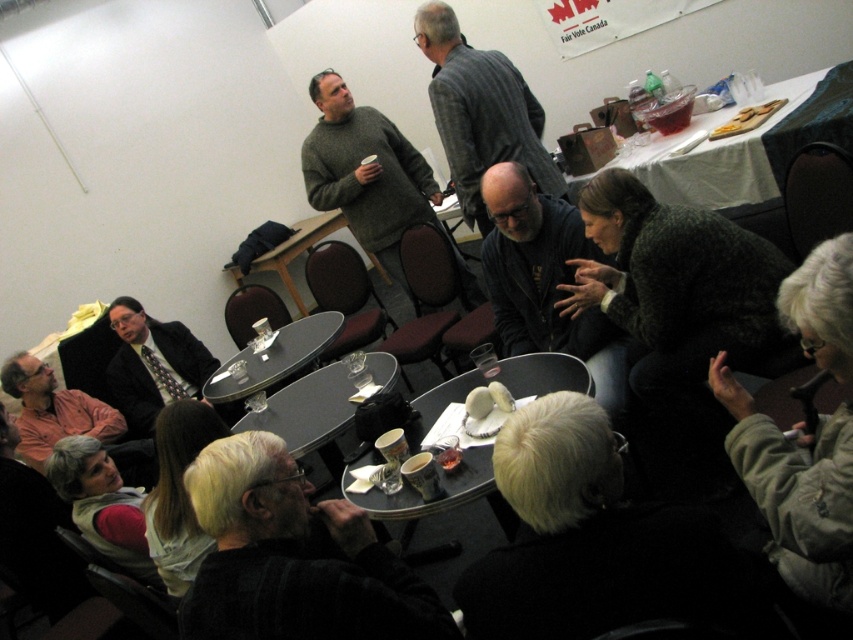
Which of these two, dark gray sweater at center or dark suit at left, stands taller?

dark suit at left

Is point (579, 336) more distant than point (165, 372)?

No, (579, 336) is closer to viewer.

Locate an element on the screen. dark gray sweater at center is located at coordinates (535, 266).

Does gray wool sweater at center appear on the left side of black glossy table at center?

Incorrect, gray wool sweater at center is not on the left side of black glossy table at center.

Who is higher up, gray wool sweater at center or black glossy table at center?

gray wool sweater at center is higher up.

Is point (509, 61) closer to camera compared to point (329, 461)?

No, (509, 61) is further to viewer.

You are a GUI agent. You are given a task and a screenshot of the screen. Output one action in this format:
    pyautogui.click(x=<x>, y=<y>)
    Task: Click on the gray wool sweater at center
    
    Given the screenshot: What is the action you would take?
    pyautogui.click(x=480, y=113)

Looking at this image, can you confirm if dark gray sweater at lower center is taller than black glass table at center?

No, dark gray sweater at lower center is not taller than black glass table at center.

Is dark gray sweater at lower center positioned behind black glass table at center?

No, dark gray sweater at lower center is in front of black glass table at center.

Which is behind, point (434, 611) or point (271, 365)?

Positioned behind is point (271, 365).

I want to click on dark gray sweater at lower center, so click(293, 557).